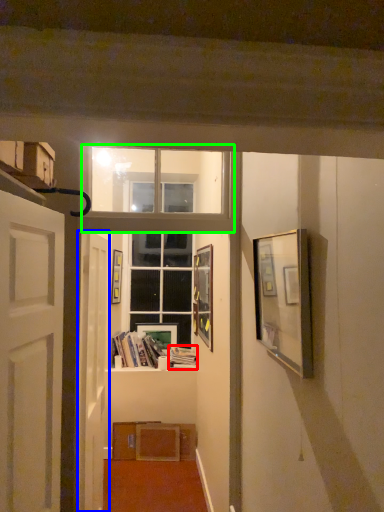
Question: Based on their relative distances, which object is nearer to book (highlighted by a red box)? Choose from door (highlighted by a blue box) and window frame (highlighted by a green box).

Choices:
 (A) door
 (B) window frame

Answer: (A)